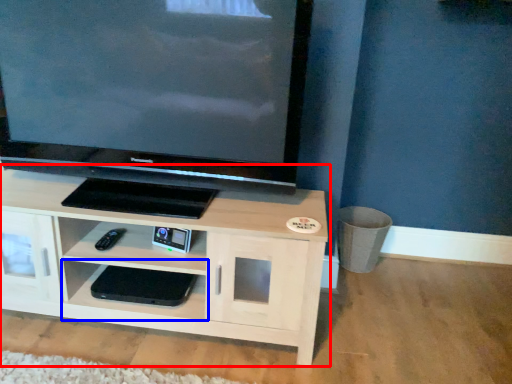
Question: Which of the following is the farthest to the observer, shelf (highlighted by a red box) or shelf (highlighted by a blue box)?

Choices:
 (A) shelf
 (B) shelf

Answer: (B)